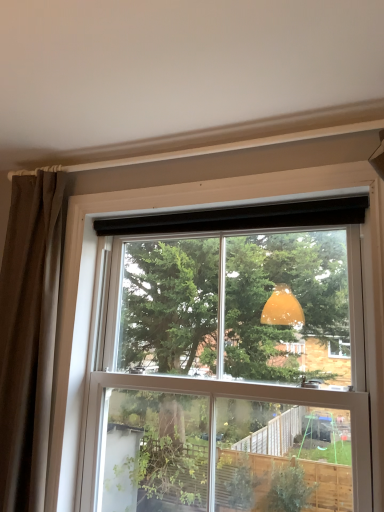
Question: From a real-world perspective, is brown fabric curtain at left located higher than transparent glass window at upper center?

Choices:
 (A) no
 (B) yes

Answer: (B)

Question: Is brown fabric curtain at left at the right side of transparent glass window at upper center?

Choices:
 (A) no
 (B) yes

Answer: (A)

Question: Is transparent glass window at upper center completely or partially inside brown fabric curtain at left?

Choices:
 (A) no
 (B) yes

Answer: (A)

Question: From a real-world perspective, is brown fabric curtain at left positioned under transparent glass window at upper center based on gravity?

Choices:
 (A) no
 (B) yes

Answer: (A)

Question: Considering the relative sizes of brown fabric curtain at left and transparent glass window at upper center in the image provided, is brown fabric curtain at left bigger than transparent glass window at upper center?

Choices:
 (A) no
 (B) yes

Answer: (A)

Question: Does brown fabric curtain at left appear on the left side of transparent glass window at upper center?

Choices:
 (A) yes
 (B) no

Answer: (A)

Question: Is transparent glass window at upper center oriented away from brown fabric curtain at left?

Choices:
 (A) yes
 (B) no

Answer: (B)

Question: Is transparent glass window at upper center at the right side of brown fabric curtain at left?

Choices:
 (A) no
 (B) yes

Answer: (B)

Question: Considering the relative positions of transparent glass window at upper center and brown fabric curtain at left in the image provided, is transparent glass window at upper center to the left of brown fabric curtain at left from the viewer's perspective?

Choices:
 (A) no
 (B) yes

Answer: (A)

Question: Is transparent glass window at upper center positioned beyond the bounds of brown fabric curtain at left?

Choices:
 (A) yes
 (B) no

Answer: (A)

Question: Is transparent glass window at upper center positioned behind brown fabric curtain at left?

Choices:
 (A) yes
 (B) no

Answer: (B)

Question: From a real-world perspective, does transparent glass window at upper center sit lower than brown fabric curtain at left?

Choices:
 (A) yes
 (B) no

Answer: (A)

Question: Considering the positions of brown fabric curtain at left and transparent glass window at upper center in the image, is brown fabric curtain at left taller or shorter than transparent glass window at upper center?

Choices:
 (A) tall
 (B) short

Answer: (A)